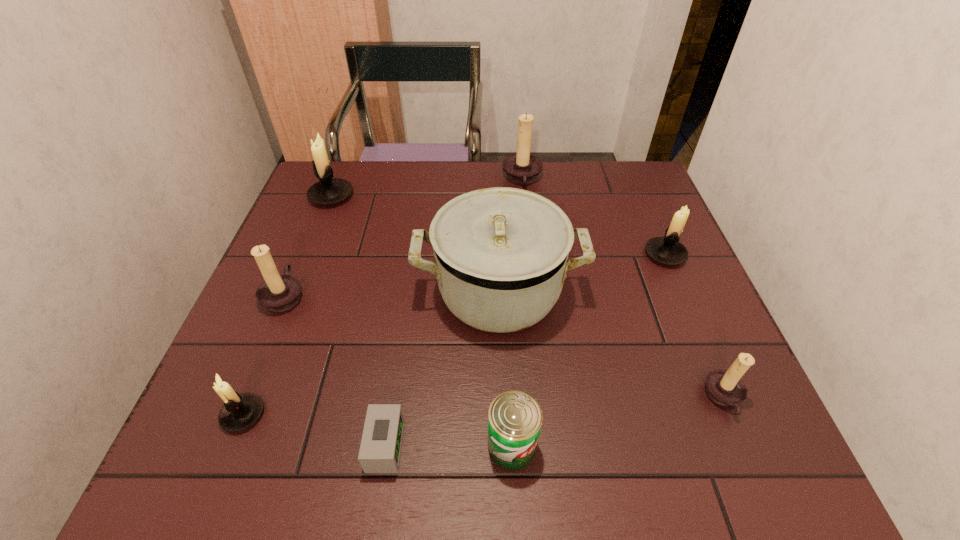
Where is `vacant space located on the right of the smallest white candle holder`? vacant space located on the right of the smallest white candle holder is located at coordinates (334, 414).

Where is `free spot located 0.180m on the wick of the rightmost brown candle holder`? This screenshot has width=960, height=540. free spot located 0.180m on the wick of the rightmost brown candle holder is located at coordinates (611, 397).

Locate an element on the screen. free space located 0.290m on the wick of the rightmost brown candle holder is located at coordinates click(554, 397).

Find the location of a particular element. The height and width of the screenshot is (540, 960). vacant space located on the wick of the rightmost brown candle holder is located at coordinates (647, 397).

Locate an element on the screen. The image size is (960, 540). vacant space located 0.300m on the right of the can is located at coordinates pyautogui.click(x=705, y=446).

Where is `vacant space situated 0.100m on the front-facing side of the shortest object`? The width and height of the screenshot is (960, 540). vacant space situated 0.100m on the front-facing side of the shortest object is located at coordinates (458, 446).

You are a GUI agent. You are given a task and a screenshot of the screen. Output one action in this format:
    pyautogui.click(x=<x>, y=<y>)
    Task: Click on the candle holder that is positioned at the near edge
    This screenshot has height=540, width=960.
    Given the screenshot: What is the action you would take?
    pyautogui.click(x=240, y=411)

Locate an element on the screen. The height and width of the screenshot is (540, 960). can present at the near edge is located at coordinates (514, 421).

Find the location of a particular element. This screenshot has height=540, width=960. alarm clock located in the near edge section of the desktop is located at coordinates (380, 449).

I want to click on object that is positioned at the far left corner, so click(x=328, y=191).